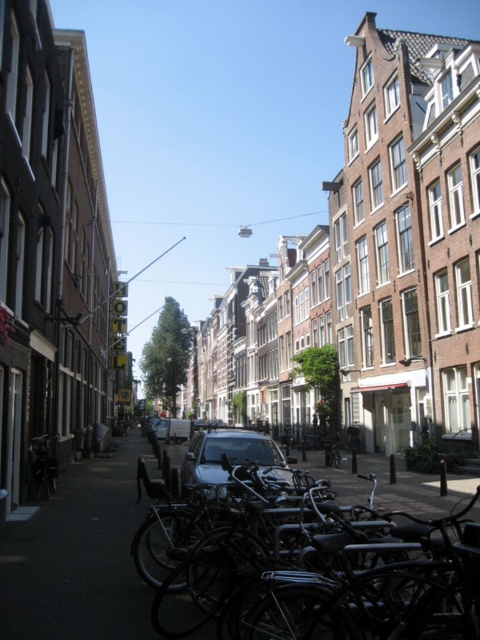
How distant is black matte bicycle at lower center from shiny black bicycle at lower left?

black matte bicycle at lower center and shiny black bicycle at lower left are 24.92 meters apart.

Who is positioned more to the right, black matte bicycle at lower center or shiny black bicycle at lower left?

black matte bicycle at lower center is more to the right.

Is point (393, 611) behind point (34, 436)?

No, it is not.

Find the location of a particular element. The height and width of the screenshot is (640, 480). black matte bicycle at lower center is located at coordinates (396, 570).

Does shiny black car at center have a lesser width compared to shiny black bicycle at lower left?

No.

Is shiny black car at center closer to camera compared to shiny black bicycle at lower left?

That is True.

Does point (252, 433) lie behind point (36, 477)?

Yes, point (252, 433) is farther from viewer.

What are the coordinates of `shiny black car at center` in the screenshot? It's located at (229, 456).

Looking at this image, can you confirm if black matte bicycle at lower center is positioned to the right of shiny black car at center?

Correct, you'll find black matte bicycle at lower center to the right of shiny black car at center.

Find the location of a particular element. The height and width of the screenshot is (640, 480). black matte bicycle at lower center is located at coordinates (396, 570).